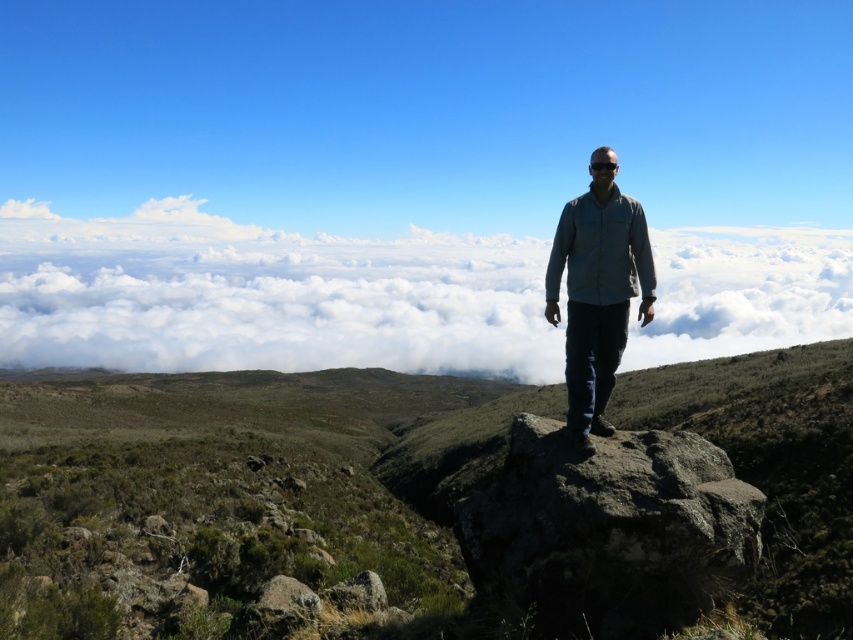
What do you see at coordinates (265, 296) in the screenshot? This screenshot has height=640, width=853. I see `white fluffy cloud at center` at bounding box center [265, 296].

Can you confirm if white fluffy cloud at center is shorter than rough gray rock at center?

No, white fluffy cloud at center is not shorter than rough gray rock at center.

Is point (676, 232) in front of point (328, 592)?

No, it is not.

At what (x,y) coordinates should I click in order to perform the action: click on white fluffy cloud at center. Please return your answer as a coordinate pair (x, y). Looking at the image, I should click on (265, 296).

Measure the distance from brown rocky mountain at center to smooth gray rock at lower left.

They are 52.21 meters apart.

Does brown rocky mountain at center appear under smooth gray rock at lower left?

Yes, brown rocky mountain at center is below smooth gray rock at lower left.

Is point (142, 609) closer to viewer compared to point (314, 596)?

No, (142, 609) is further to viewer.

Locate an element on the screen. brown rocky mountain at center is located at coordinates (250, 486).

Between point (44, 524) and point (56, 305), which one is positioned in front?

Point (44, 524)

Does brown rocky mountain at center have a lesser width compared to white fluffy cloud at center?

Indeed, brown rocky mountain at center has a lesser width compared to white fluffy cloud at center.

The width and height of the screenshot is (853, 640). I want to click on brown rocky mountain at center, so click(x=250, y=486).

Find the location of a particular element. brown rocky mountain at center is located at coordinates (250, 486).